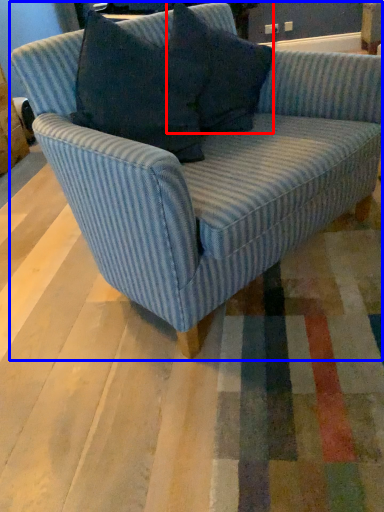
Question: Which object appears closest to the camera in this image, pillow (highlighted by a red box) or studio couch (highlighted by a blue box)?

Choices:
 (A) pillow
 (B) studio couch

Answer: (B)